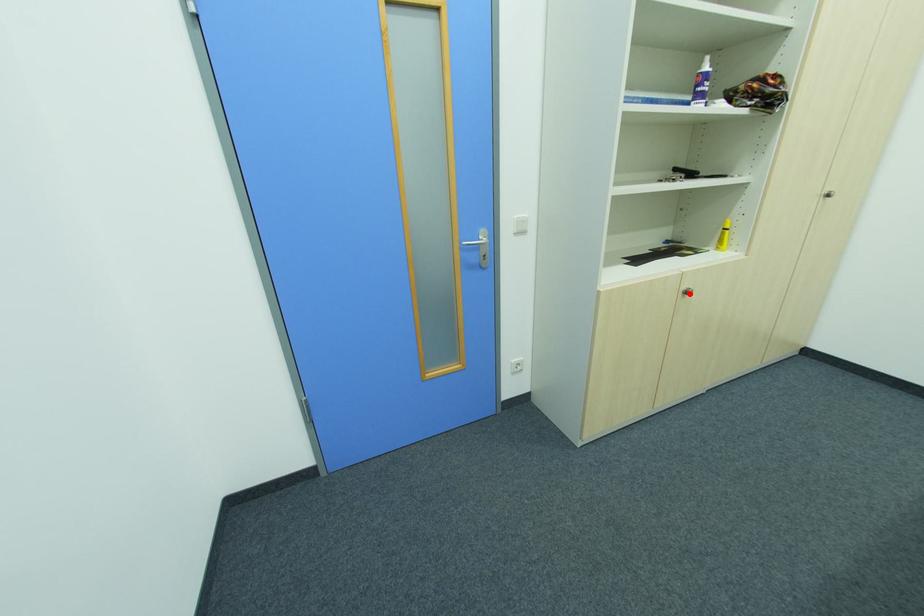
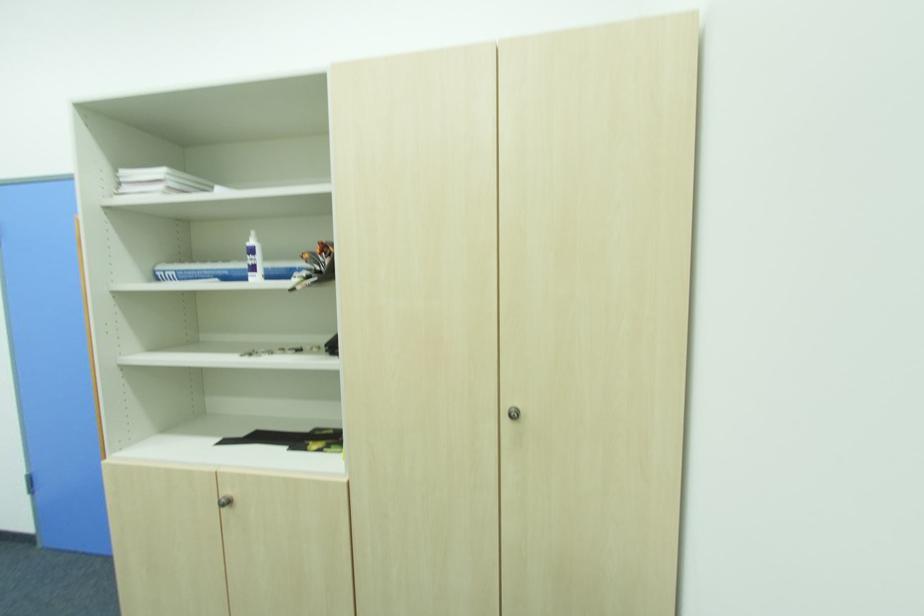
Locate, in the second image, the point that corresponds to the highlighted location in the first image.

(229, 504)